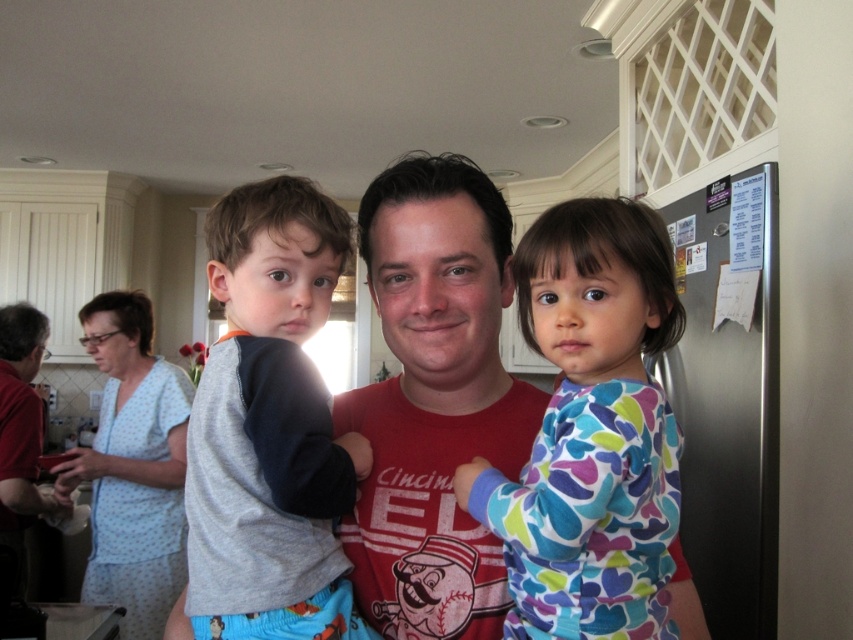
Who is shorter, multicolored fleece pajamas at right or light blue dotted dress at left?

Standing shorter between the two is multicolored fleece pajamas at right.

Can you confirm if multicolored fleece pajamas at right is shorter than light blue dotted dress at left?

Yes.

Does point (671, 499) lie in front of point (117, 422)?

Yes, point (671, 499) is in front of point (117, 422).

At what (x,y) coordinates should I click in order to perform the action: click on multicolored fleece pajamas at right. Please return your answer as a coordinate pair (x, y). This screenshot has height=640, width=853. Looking at the image, I should click on (590, 429).

Between gray fleece shirt at center and light blue dotted dress at left, which one appears on the right side from the viewer's perspective?

Positioned to the right is gray fleece shirt at center.

What are the coordinates of `gray fleece shirt at center` in the screenshot? It's located at (270, 426).

Is multicolored fleece pajamas at right positioned at the back of gray fleece shirt at center?

No, multicolored fleece pajamas at right is in front of gray fleece shirt at center.

Which is below, multicolored fleece pajamas at right or gray fleece shirt at center?

multicolored fleece pajamas at right is lower down.

Is point (625, 470) farther from viewer compared to point (329, 424)?

No, (625, 470) is closer to viewer.

Find the location of a particular element. This screenshot has width=853, height=640. multicolored fleece pajamas at right is located at coordinates (590, 429).